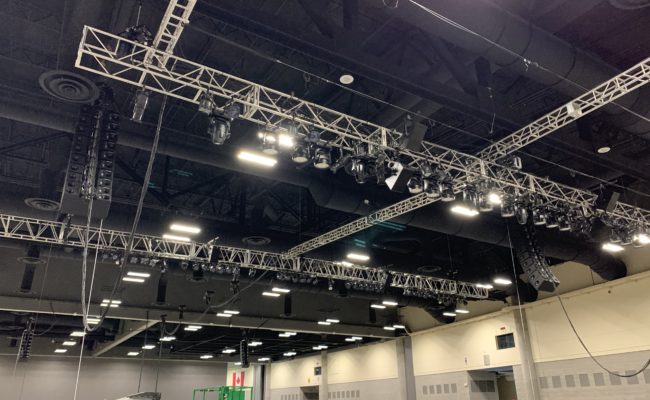
The image size is (650, 400). In order to click on cream wall in this screenshot , I will do `click(283, 375)`, `click(370, 376)`, `click(572, 335)`.